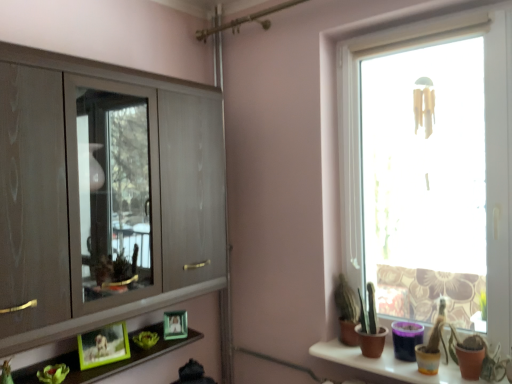
You are a GUI agent. You are given a task and a screenshot of the screen. Output one action in this format:
    pyautogui.click(x=<x>, y=<y>)
    Task: Click on the free point above transparent glass window at right (from a real-world perspective)
    This screenshot has width=512, height=384.
    Given the screenshot: What is the action you would take?
    pyautogui.click(x=439, y=6)